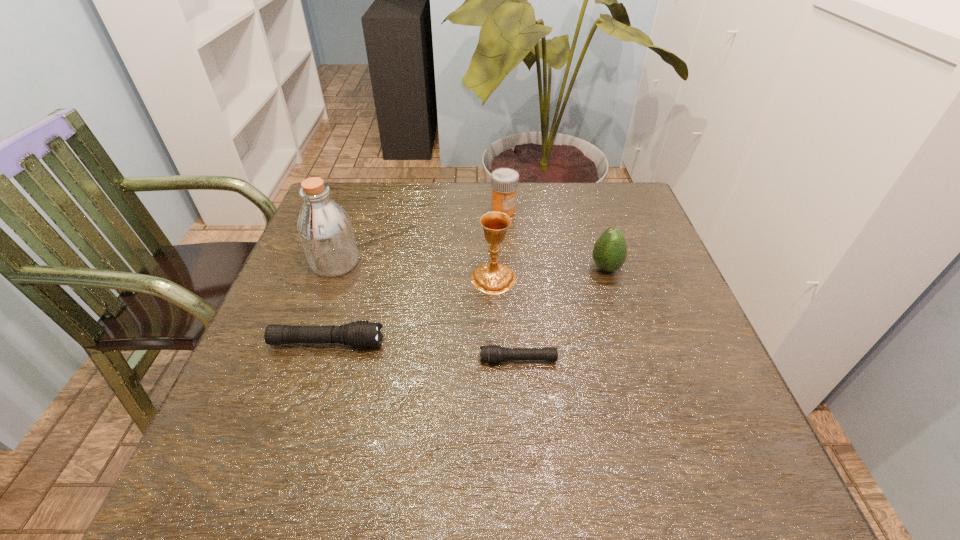
Locate an element on the screen. This screenshot has width=960, height=540. free space located 0.090m at the lens end of the shortest object is located at coordinates (434, 360).

Locate an element on the screen. The image size is (960, 540). vacant area situated 0.240m at the lens end of the shortest object is located at coordinates (357, 360).

I want to click on free spot located 0.240m on the label side of the medicine, so click(x=508, y=277).

Locate an element on the screen. The height and width of the screenshot is (540, 960). vacant position located 0.150m on the left of the second tallest object is located at coordinates [407, 279].

Identify the location of free point located on the right of the tallest object. Image resolution: width=960 pixels, height=540 pixels. (384, 263).

Identify the location of vacant space located on the front of the avocado. Image resolution: width=960 pixels, height=540 pixels. (655, 425).

Locate an element on the screen. object that is at the far edge is located at coordinates (504, 181).

The width and height of the screenshot is (960, 540). Find the location of `flashlight situated at the left edge`. flashlight situated at the left edge is located at coordinates (362, 334).

Locate an element on the screen. The width and height of the screenshot is (960, 540). bottle that is at the left edge is located at coordinates (325, 229).

The image size is (960, 540). I want to click on object that is at the right edge, so click(609, 253).